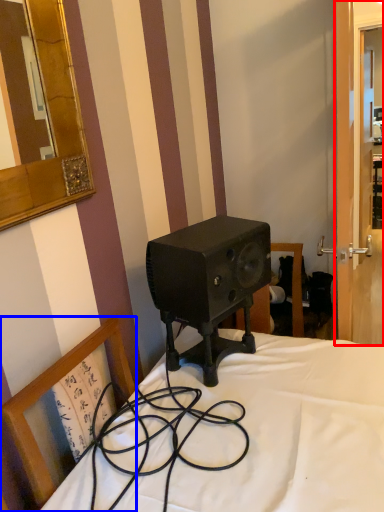
Question: Which object is closer to the camera taking this photo, screen door (highlighted by a red box) or chair (highlighted by a blue box)?

Choices:
 (A) screen door
 (B) chair

Answer: (B)